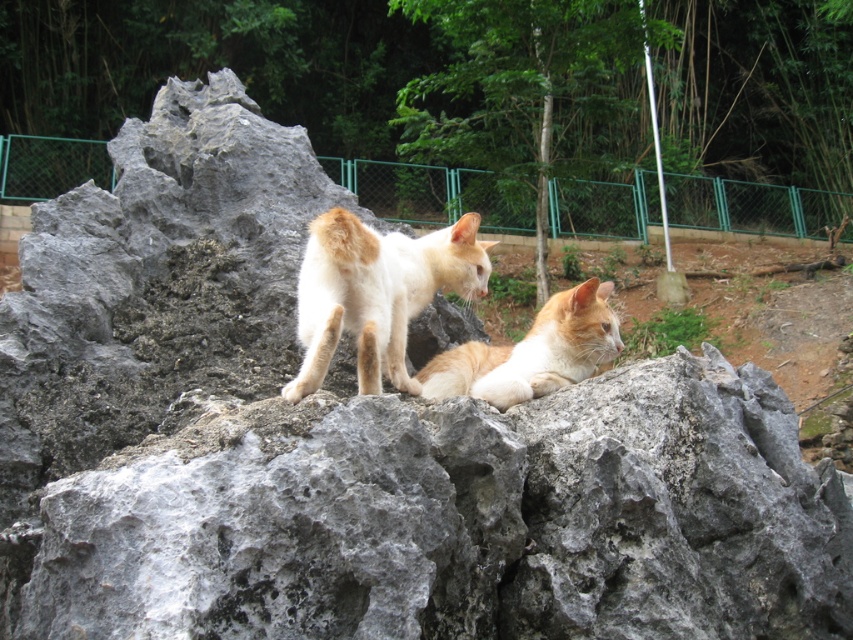
You are a photographer trying to capture both the green metal fence at upper center and the white fur cat at center in a single shot. Based on their sizes in the image, which object should you focus on first to ensure both are in frame?

The green metal fence at upper center is smaller than the white fur cat at center, so you should focus on the white fur cat at center first to ensure both fit in the frame.